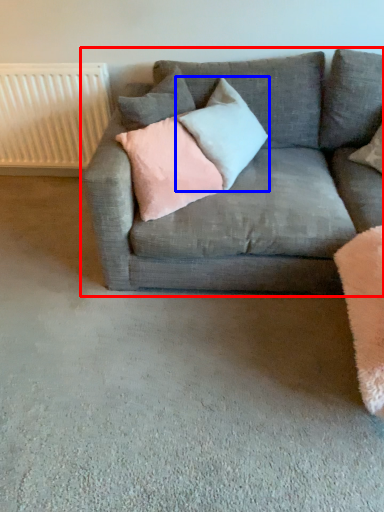
Question: Among these objects, which one is nearest to the camera, studio couch (highlighted by a red box) or pillow (highlighted by a blue box)?

Choices:
 (A) studio couch
 (B) pillow

Answer: (A)